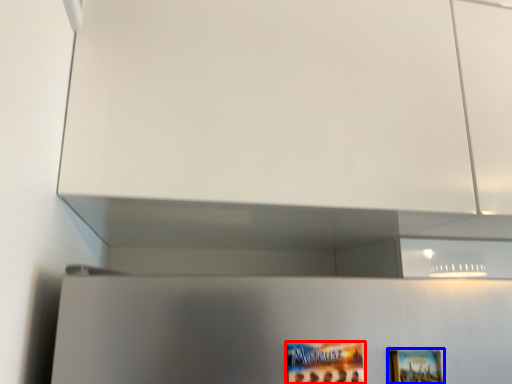
Question: Which point is closer to the camera, movie poster (highlighted by a red box) or picture frame (highlighted by a blue box)?

Choices:
 (A) movie poster
 (B) picture frame

Answer: (A)